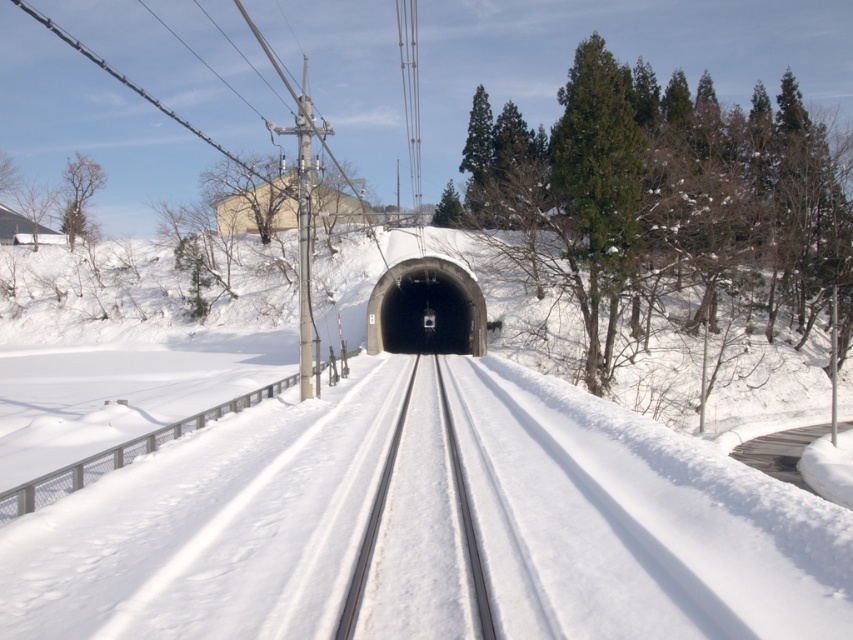
You are a train engineer needing to ensure the tunnel is wide enough for your train. Given that the metallic wires at center are 3 meters wide, can the black concrete tunnel at center accommodate a train that requires a minimum of 2.5 meters of clearance?

The black concrete tunnel at center has a lesser width compared to metallic wires at center, which are 3 meters wide. Since the tunnel is narrower than the wires, its width is less than 3 meters. The train requires a minimum of 2.5 meters of clearance. If the tunnel is narrower than 3 meters but still wider than 2.5 meters, it might fit. However, since the exact width isn

From the picture: You are a train engineer who needs to ensure safe passage through the tunnel. Given the black concrete tunnel at center and the metallic wires at center, which one is shorter in height?

The black concrete tunnel at center has a lesser height compared to the metallic wires at center, so the tunnel is shorter in height than the wires.

You are standing at the starting point of the railway track in the winter scene. You want to walk towards the tunnel entrance. Which direction should you head to reach the black concrete tunnel at center?

The black concrete tunnel at center is located at point coordinates approximately 0.484 on the x axis and 0.501 on the y axis. Since you are at the starting point of the railway track, you should head forward along the tracks towards the tunnel entrance as it is directly ahead of you in the center of the scene.